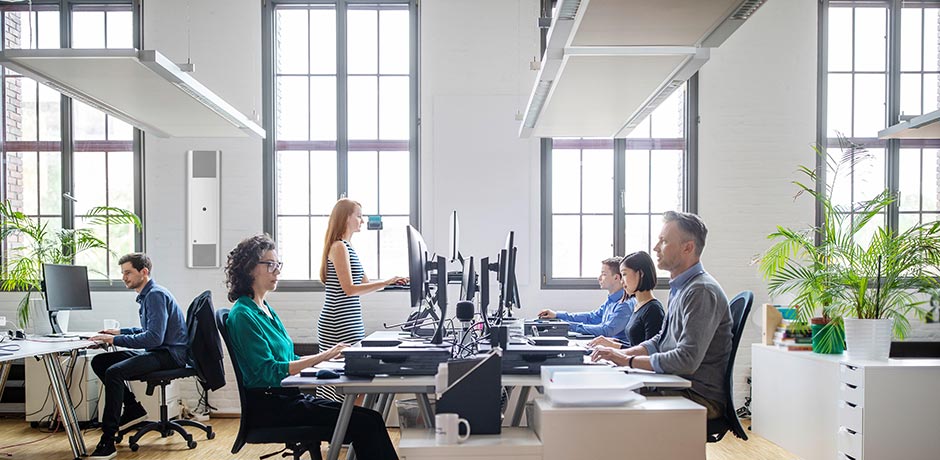
You are a GUI agent. You are given a task and a screenshot of the screen. Output one action in this format:
    pyautogui.click(x=<x>, y=<y>)
    Task: Click on the drawers in a filing cabinet
    
    Given the screenshot: What is the action you would take?
    pyautogui.click(x=853, y=372), pyautogui.click(x=852, y=389), pyautogui.click(x=850, y=415), pyautogui.click(x=850, y=438), pyautogui.click(x=842, y=456)